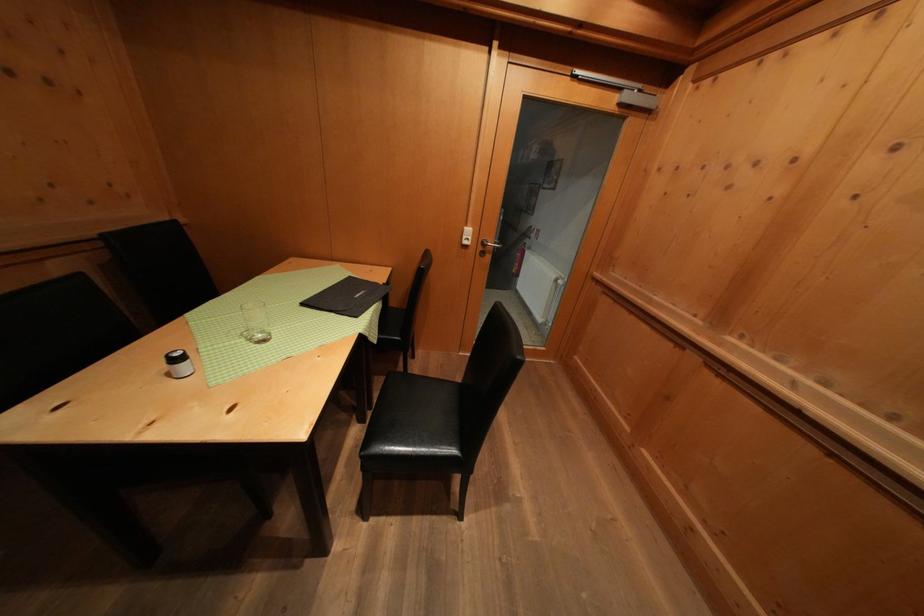
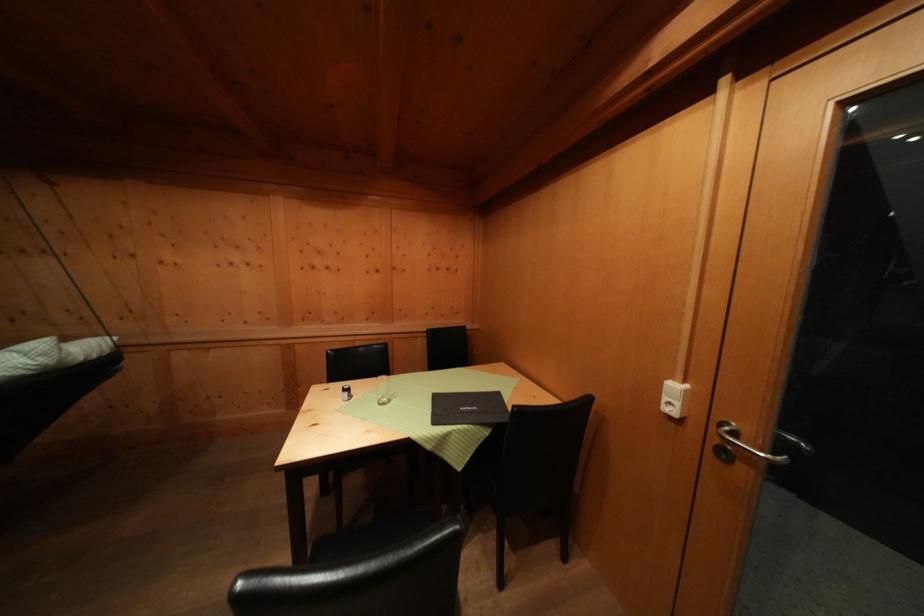
The point at (x=470, y=241) is marked in the first image. Where is the corresponding point in the second image?

(672, 403)